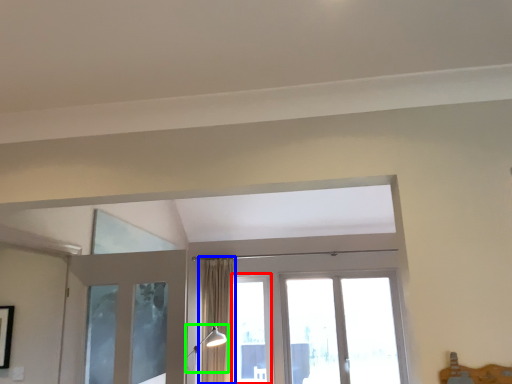
Question: Based on their relative distances, which object is nearer to window (highlighted by a red box)? Choose from curtain (highlighted by a blue box) and light fixture (highlighted by a green box).

Choices:
 (A) curtain
 (B) light fixture

Answer: (A)